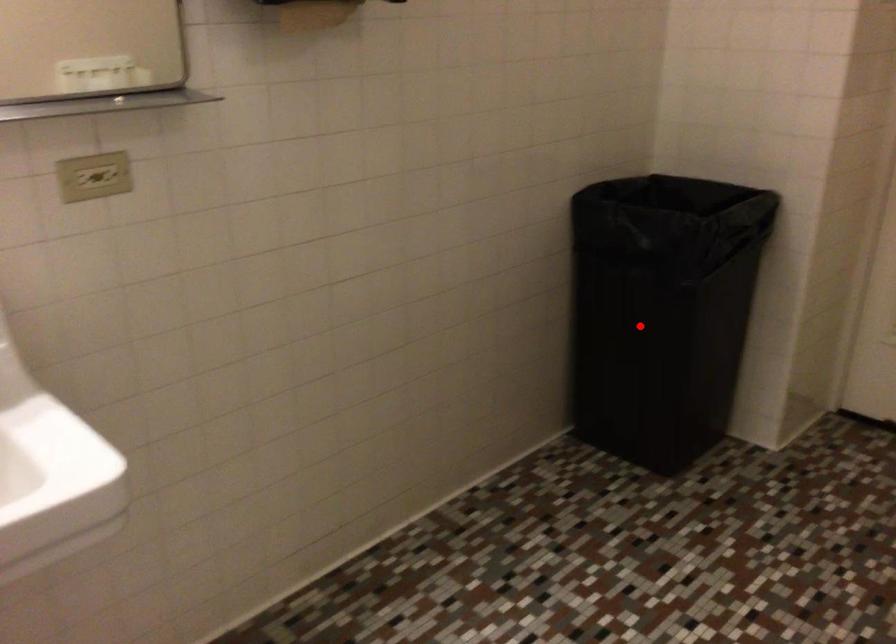
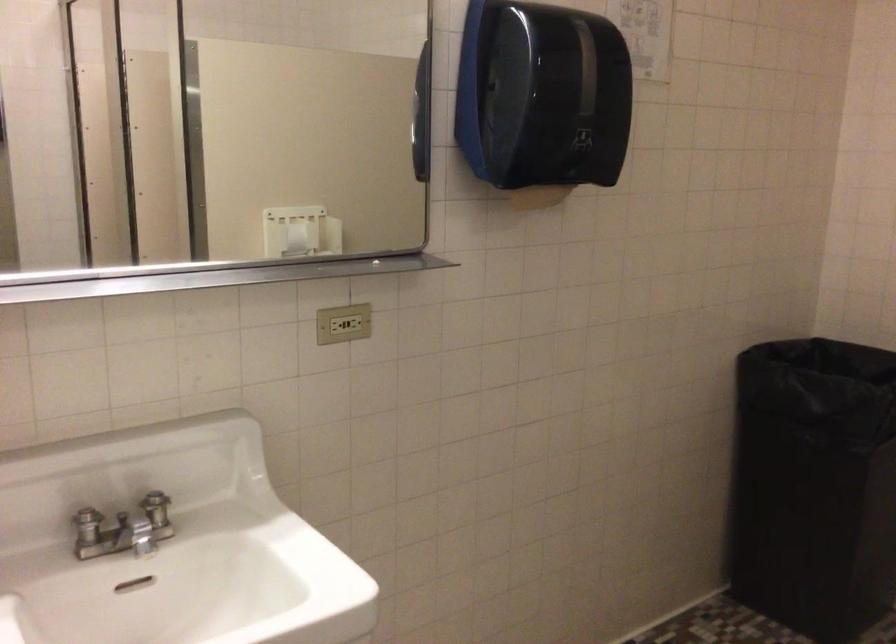
Where in the second image is the point corresponding to the highlighted location from the first image?

(814, 486)